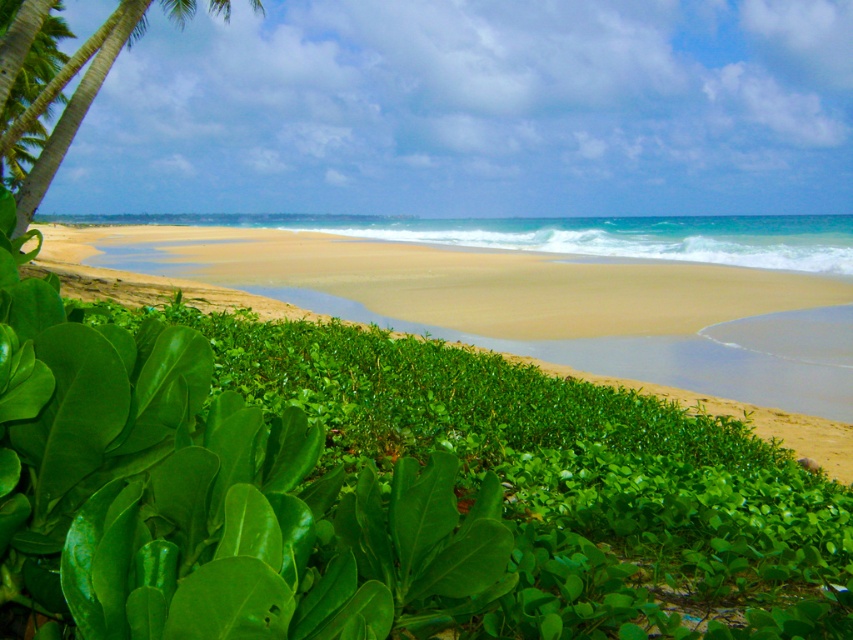
Between green leafy vegetation at lower left and green leafy palm tree at upper left, which one appears on the left side from the viewer's perspective?

Positioned to the left is green leafy vegetation at lower left.

What do you see at coordinates (438, 280) in the screenshot?
I see `green leafy vegetation at lower left` at bounding box center [438, 280].

This screenshot has width=853, height=640. In order to click on green leafy vegetation at lower left in this screenshot , I will do `click(438, 280)`.

Locate an element on the screen. green leafy vegetation at lower left is located at coordinates (438, 280).